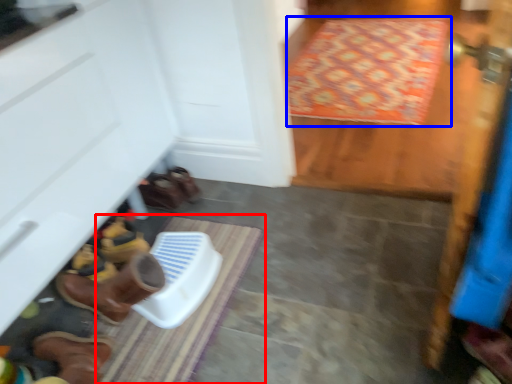
Question: Which object appears farthest to the camera in this image, doormat (highlighted by a red box) or doormat (highlighted by a blue box)?

Choices:
 (A) doormat
 (B) doormat

Answer: (B)